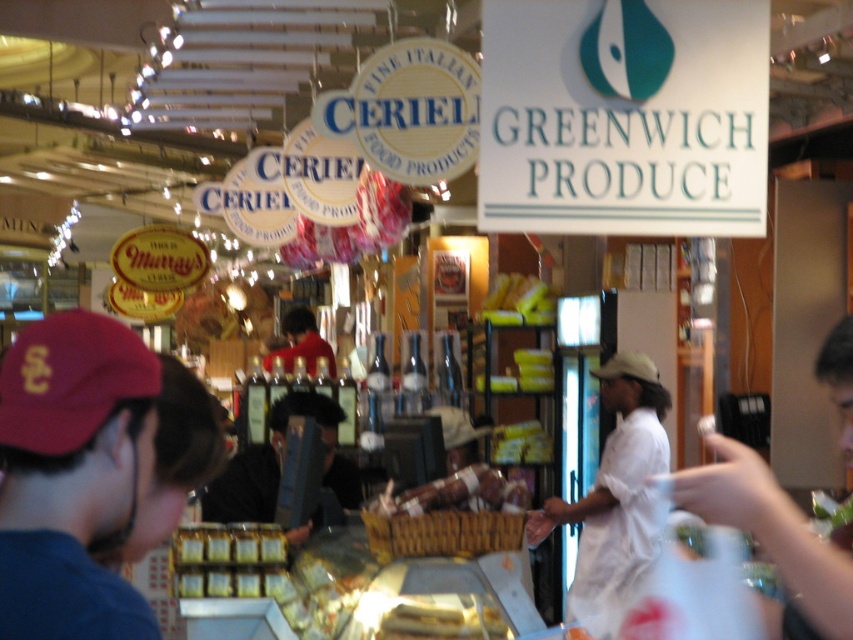
Is maroon fabric cap at left taller than striped plastic sausage at center?

Correct, maroon fabric cap at left is much taller as striped plastic sausage at center.

Does maroon fabric cap at left appear on the right side of striped plastic sausage at center?

Incorrect, maroon fabric cap at left is not on the right side of striped plastic sausage at center.

Locate an element on the screen. This screenshot has width=853, height=640. maroon fabric cap at left is located at coordinates (74, 476).

I want to click on maroon fabric cap at left, so click(74, 476).

Who is shorter, maroon fabric cap at left or matte red shirt at center?

maroon fabric cap at left is shorter.

Does maroon fabric cap at left appear under matte red shirt at center?

Incorrect, maroon fabric cap at left is not positioned below matte red shirt at center.

What do you see at coordinates (74, 476) in the screenshot?
I see `maroon fabric cap at left` at bounding box center [74, 476].

This screenshot has height=640, width=853. I want to click on maroon fabric cap at left, so click(74, 476).

Can you confirm if shiny red candy at center is bigger than striped plastic sausage at center?

Yes.

Who is positioned more to the left, shiny red candy at center or striped plastic sausage at center?

shiny red candy at center is more to the left.

Is point (401, 202) closer to camera compared to point (386, 486)?

No, it is not.

Where is `shiny red candy at center`? shiny red candy at center is located at coordinates (354, 225).